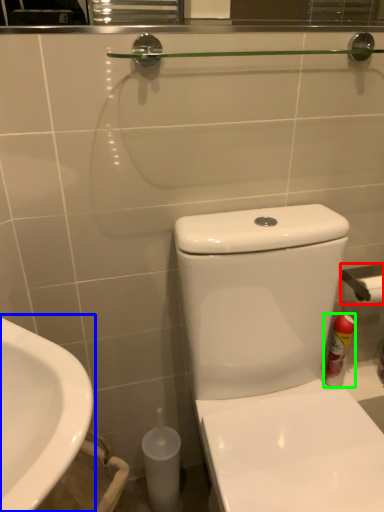
Question: Which is nearer to the towel bar (highlighted by a red box)? sink (highlighted by a blue box) or cleaning product (highlighted by a green box).

Choices:
 (A) sink
 (B) cleaning product

Answer: (B)